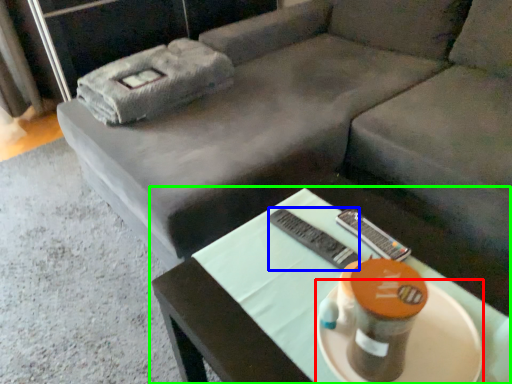
Question: Based on their relative distances, which object is nearer to platter (highlighted by a red box)? Choose from remote (highlighted by a blue box) and table (highlighted by a green box).

Choices:
 (A) remote
 (B) table

Answer: (B)